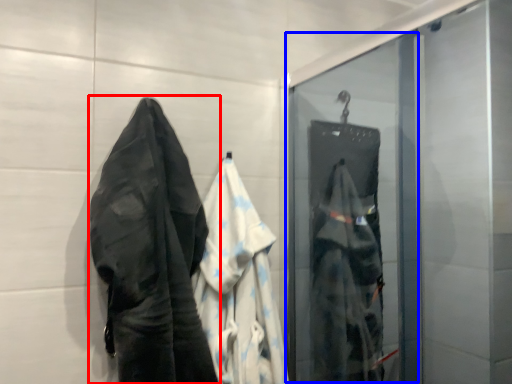
Question: Which of the following is the farthest to the observer, towel (highlighted by a red box) or screen door (highlighted by a blue box)?

Choices:
 (A) towel
 (B) screen door

Answer: (B)